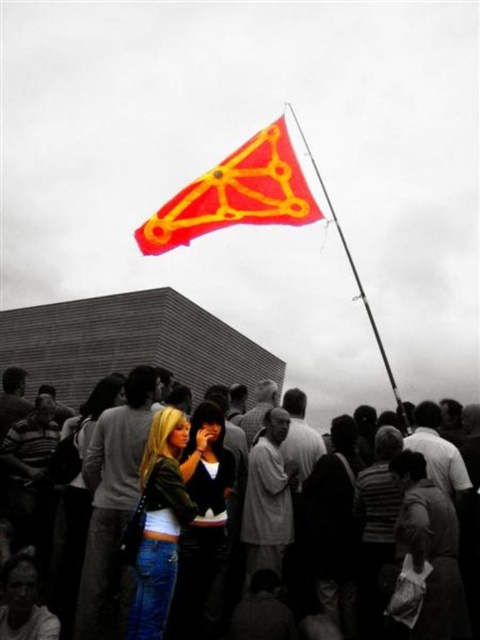
Can you confirm if denim jacket at lower left is positioned to the right of gray fabric shirt at center?

Incorrect, denim jacket at lower left is not on the right side of gray fabric shirt at center.

Who is lower down, denim jacket at lower left or gray fabric shirt at center?

denim jacket at lower left is lower down.

The width and height of the screenshot is (480, 640). I want to click on denim jacket at lower left, so click(160, 520).

Which is more to the left, matte green jacket at center or gray fabric shirt at center?

Positioned to the left is matte green jacket at center.

Find the location of a particular element. Image resolution: width=480 pixels, height=640 pixels. matte green jacket at center is located at coordinates (202, 522).

Between denim jacket at lower left and matte green jacket at center, which one appears on the left side from the viewer's perspective?

From the viewer's perspective, denim jacket at lower left appears more on the left side.

Which is in front, point (164, 572) or point (218, 420)?

Point (164, 572) is more forward.

In order to click on denim jacket at lower left in this screenshot , I will do `click(160, 520)`.